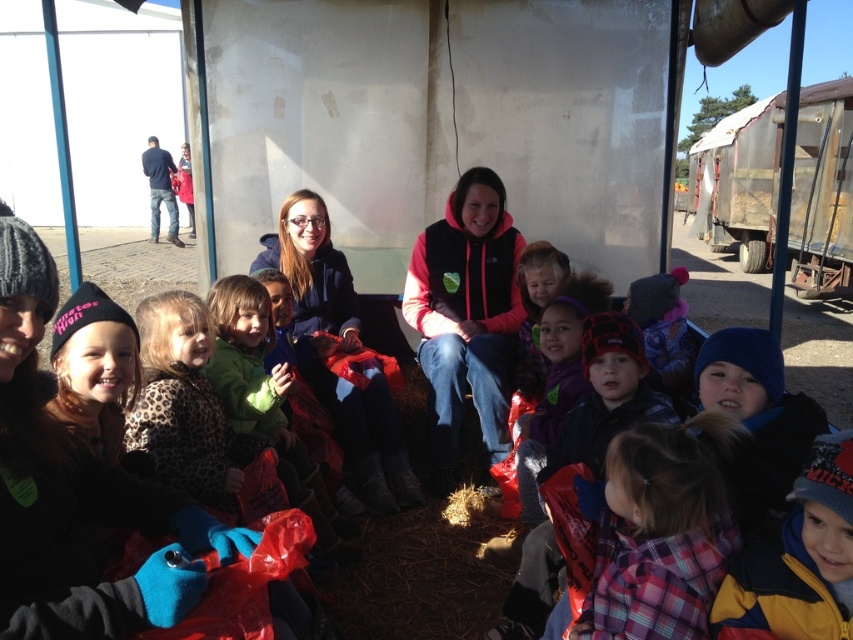
Does plaid fabric at lower center lie behind matte blue hoodie at center?

No, it is in front of matte blue hoodie at center.

Which is behind, point (630, 531) or point (292, 314)?

The point (292, 314) is behind.

Where is `plaid fabric at lower center`? plaid fabric at lower center is located at coordinates (660, 531).

Which is behind, point (683, 518) or point (816, 550)?

The point (683, 518) is more distant.

Between plaid fabric at lower center and yellow fleece jacket at lower right, which one is positioned higher?

yellow fleece jacket at lower right is higher up.

Describe the element at coordinates (660, 531) in the screenshot. I see `plaid fabric at lower center` at that location.

At what (x,y) coordinates should I click in order to perform the action: click on plaid fabric at lower center. Please return your answer as a coordinate pair (x, y). The height and width of the screenshot is (640, 853). Looking at the image, I should click on (660, 531).

Is matte blue hoodie at center to the right of leopard print coat at center from the viewer's perspective?

Correct, you'll find matte blue hoodie at center to the right of leopard print coat at center.

Is matte blue hoodie at center below leopard print coat at center?

Actually, matte blue hoodie at center is above leopard print coat at center.

Which is behind, point (363, 460) or point (173, 372)?

The point (363, 460) is behind.

I want to click on matte blue hoodie at center, so click(339, 353).